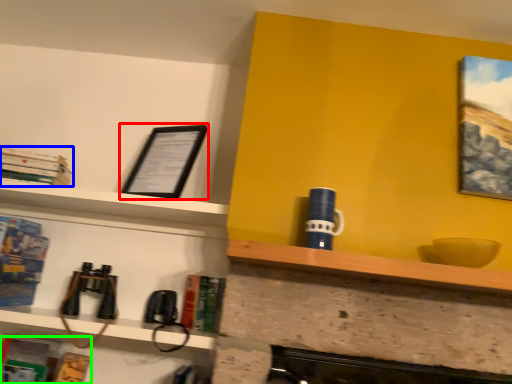
Question: Based on their relative distances, which object is farther from picture frame (highlighted by a red box)? Choose from book (highlighted by a blue box) and book (highlighted by a green box).

Choices:
 (A) book
 (B) book

Answer: (B)